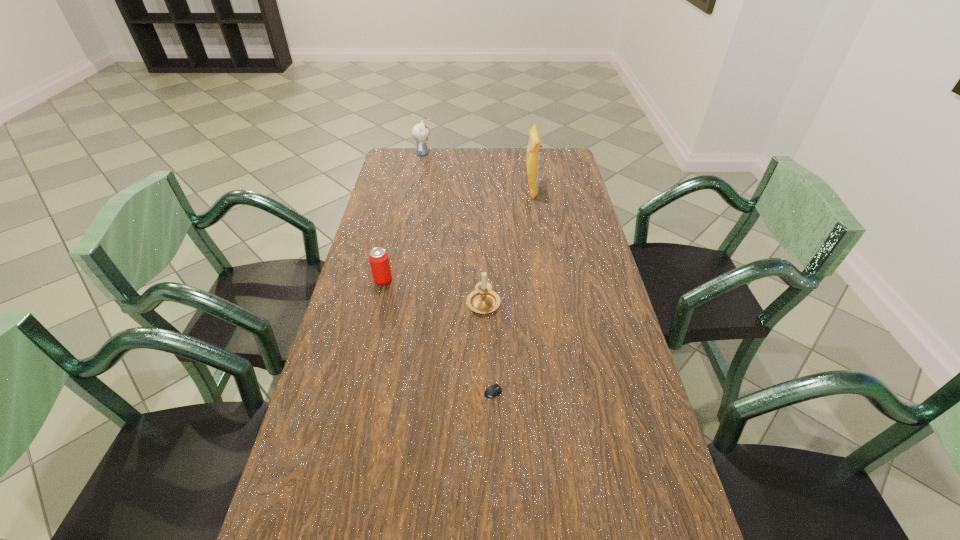
I want to click on the tallest object, so click(534, 150).

Image resolution: width=960 pixels, height=540 pixels. In order to click on the second farthest object in this screenshot , I will do `click(534, 150)`.

In order to click on the farthest object in this screenshot , I will do `click(420, 132)`.

Find the location of `the fourth farthest object`. the fourth farthest object is located at coordinates (483, 300).

The width and height of the screenshot is (960, 540). I want to click on beer can, so click(379, 261).

This screenshot has height=540, width=960. What are the coordinates of `the shortest object` in the screenshot? It's located at (494, 390).

Locate an element on the screen. Image resolution: width=960 pixels, height=540 pixels. the nearest object is located at coordinates (494, 390).

The width and height of the screenshot is (960, 540). Find the location of `vacant space situated 0.130m on the front of the fourth nearest object with the logo`. vacant space situated 0.130m on the front of the fourth nearest object with the logo is located at coordinates (492, 190).

Find the location of `free location located on the front of the fourth nearest object with the logo`. free location located on the front of the fourth nearest object with the logo is located at coordinates [476, 190].

In order to click on vacant space situated on the front of the fourth nearest object with the logo in this screenshot , I will do `click(463, 190)`.